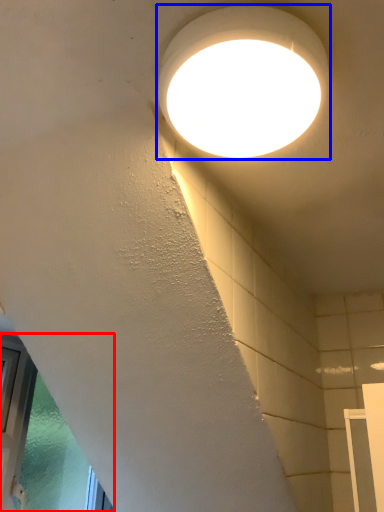
Question: Which point is further to the camera, window (highlighted by a red box) or lamp (highlighted by a blue box)?

Choices:
 (A) window
 (B) lamp

Answer: (A)